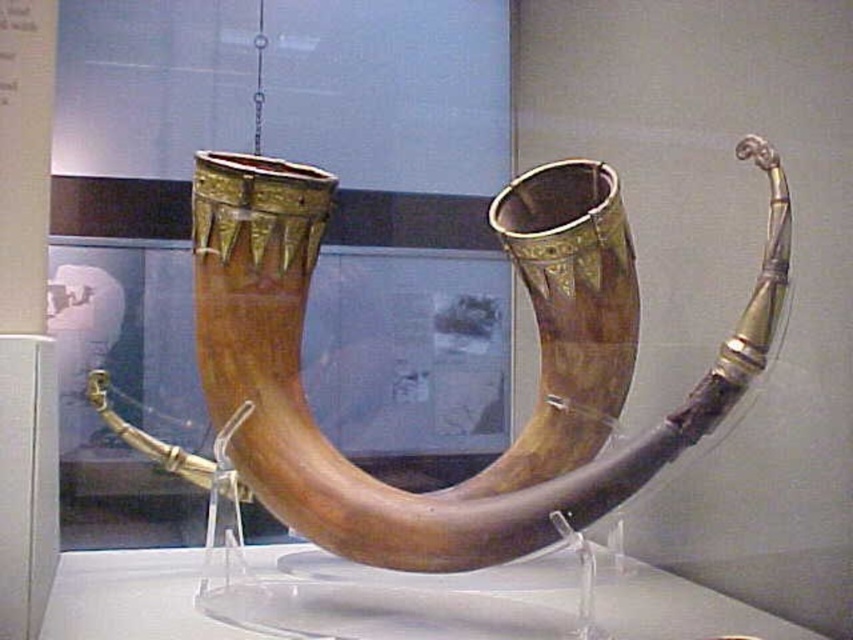
You are a museum curator planning to install a protective glass case around the polished wood horn at center and the transparent acrylic table at center. The glass case must accommodate both objects. Based on their sizes, which object requires the case to be taller?

The polished wood horn at center is taller than the transparent acrylic table at center, so the glass case needs to be tall enough to accommodate the height of the polished wood horn at center.

You are a museum curator arranging an exhibit. The polished wood horn at center needs to be moved to the left side of the transparent acrylic table at center for better visibility. Is this possible without moving the table?

The polished wood horn at center is currently to the right of the transparent acrylic table at center. To move it to the left side of the table, you would need to reposition the horn around the table, which is feasible without moving the table itself, as the horn is not fixed in place.